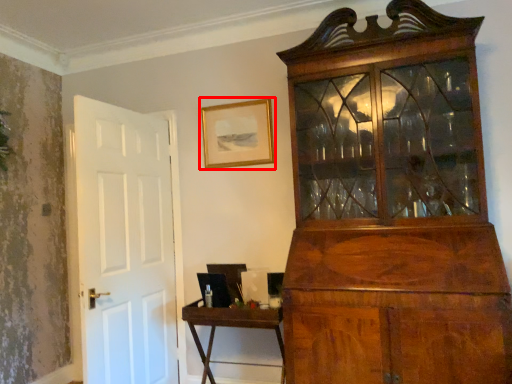
Question: In this image, where is picture frame (annotated by the red box) located relative to table?

Choices:
 (A) left
 (B) right

Answer: (A)